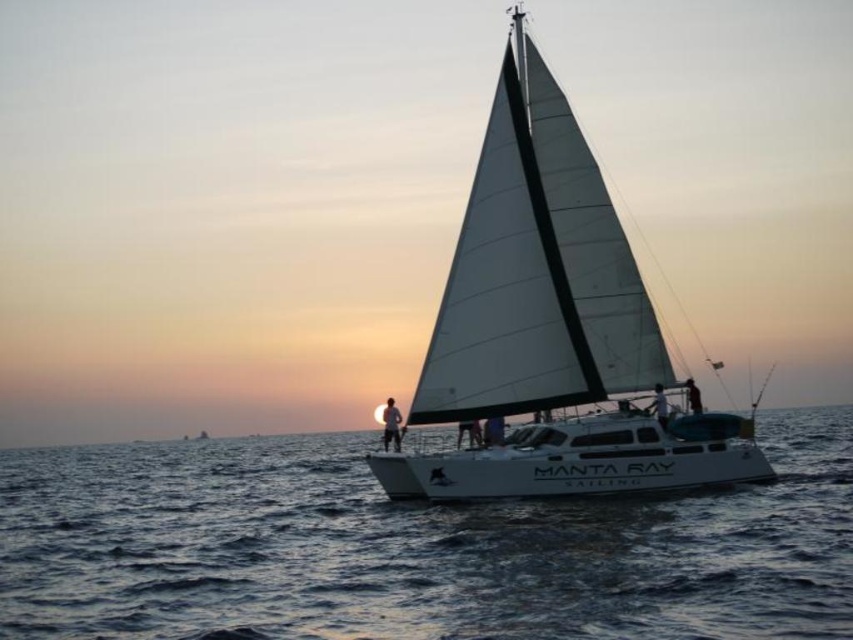
Between point (393, 410) and point (693, 388), which one is positioned behind?

Positioned behind is point (393, 410).

Is point (392, 435) positioned after point (700, 406)?

Yes, it is behind point (700, 406).

Image resolution: width=853 pixels, height=640 pixels. What are the coordinates of `matte white person at center` in the screenshot? It's located at (392, 426).

Does dark blue water at center lie in front of white fabric sail at center?

Yes, dark blue water at center is closer to the viewer.

Does point (788, 612) come in front of point (659, 416)?

Yes, point (788, 612) is in front of point (659, 416).

The height and width of the screenshot is (640, 853). I want to click on dark blue water at center, so click(x=413, y=548).

Who is positioned more to the left, matte white person at center or white fabric sail at center?

Positioned to the left is matte white person at center.

Between matte white person at center and white fabric sail at center, which one is positioned lower?

matte white person at center is lower down.

The image size is (853, 640). Identify the location of matte white person at center. (392, 426).

This screenshot has width=853, height=640. In order to click on matte white person at center in this screenshot , I will do `click(392, 426)`.